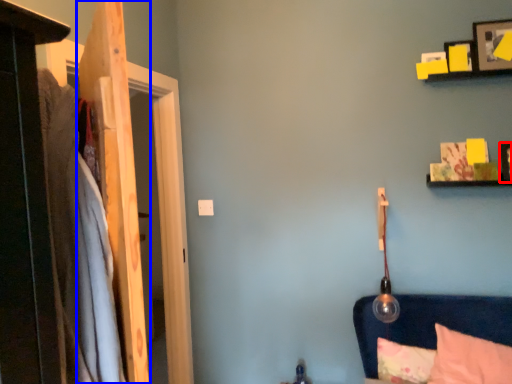
Question: Among these objects, which one is nearest to the camera, picture frame (highlighted by a red box) or door (highlighted by a blue box)?

Choices:
 (A) picture frame
 (B) door

Answer: (B)